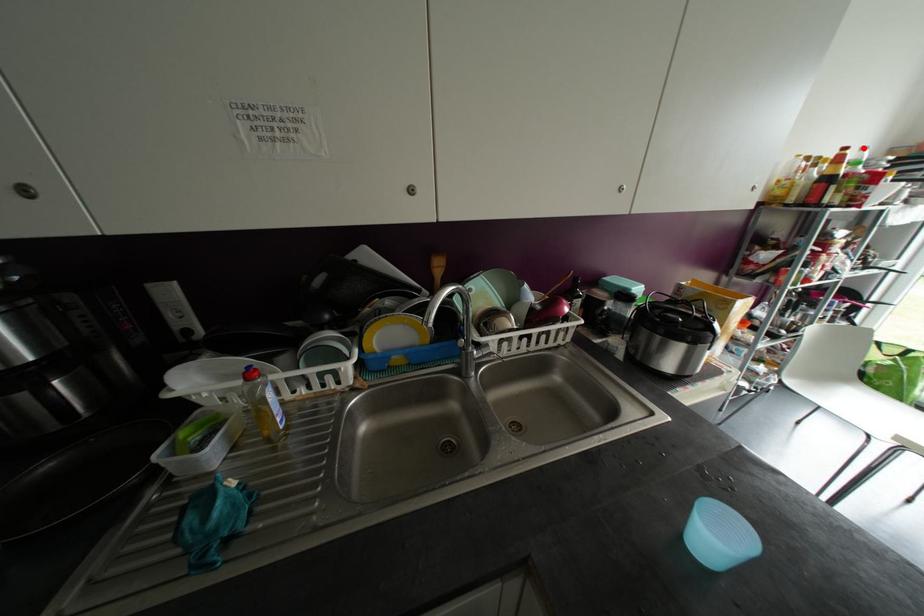
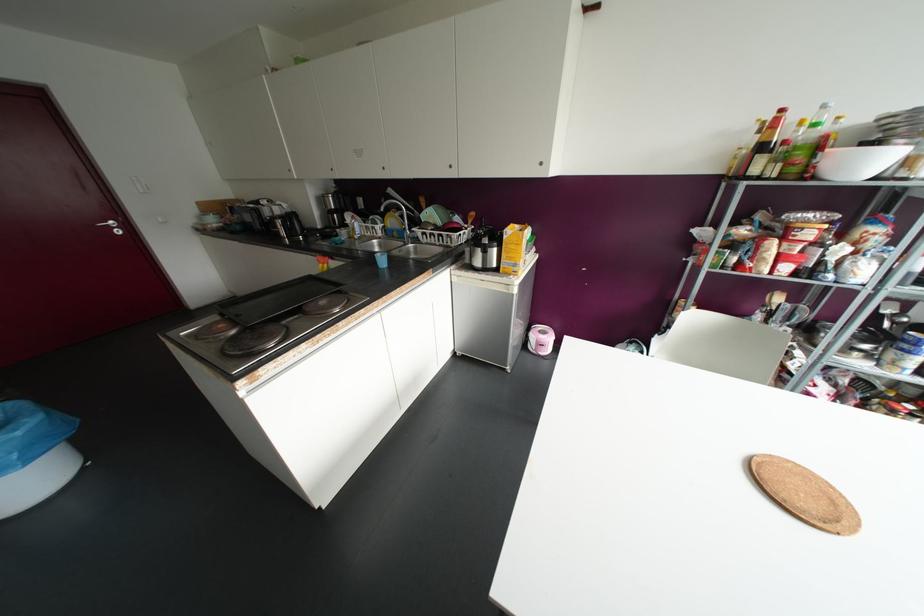
Question: A red point is marked in image1. In image2, is the corresponding 3D point closer to the camera or farther? Reply with the corresponding letter.

Choices:
 (A) The corresponding 3D point is closer.
 (B) The corresponding 3D point is farther.

Answer: (A)